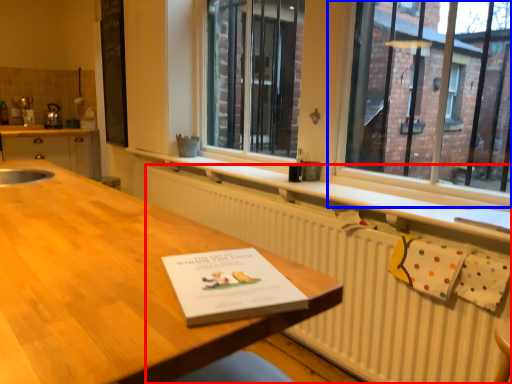
Question: Which point is closer to the camera, radiator (highlighted by a red box) or window (highlighted by a blue box)?

Choices:
 (A) radiator
 (B) window

Answer: (A)